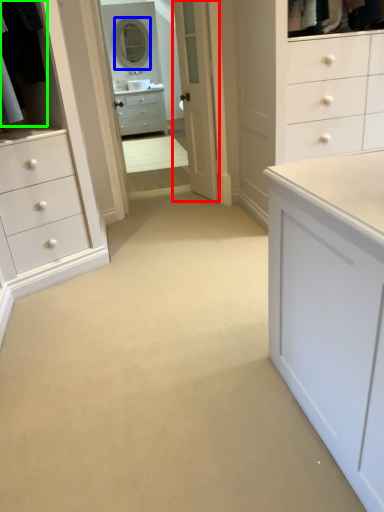
Question: Which object is positioned closest to door (highlighted by a red box)? Select from mirror (highlighted by a blue box) and laundry (highlighted by a green box).

Choices:
 (A) mirror
 (B) laundry

Answer: (B)